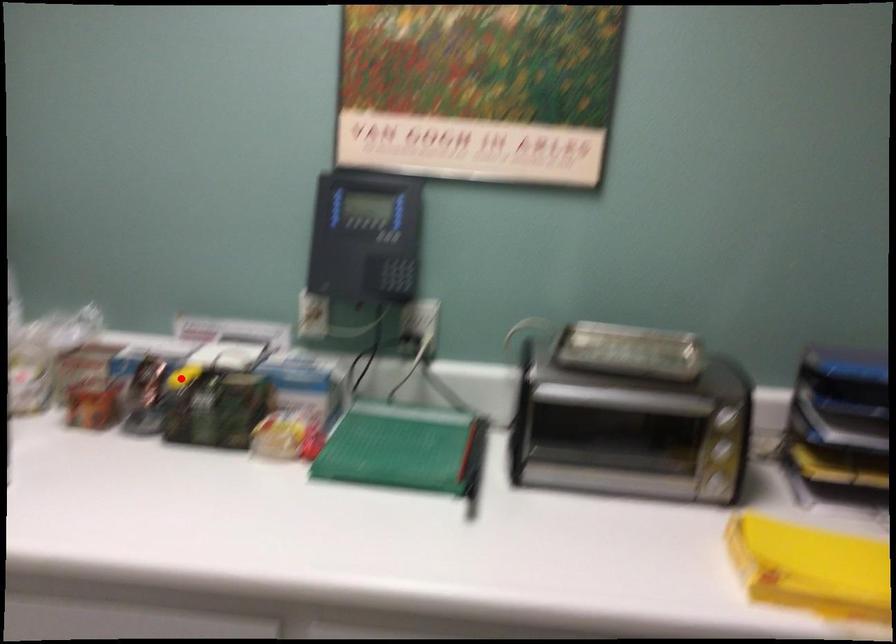
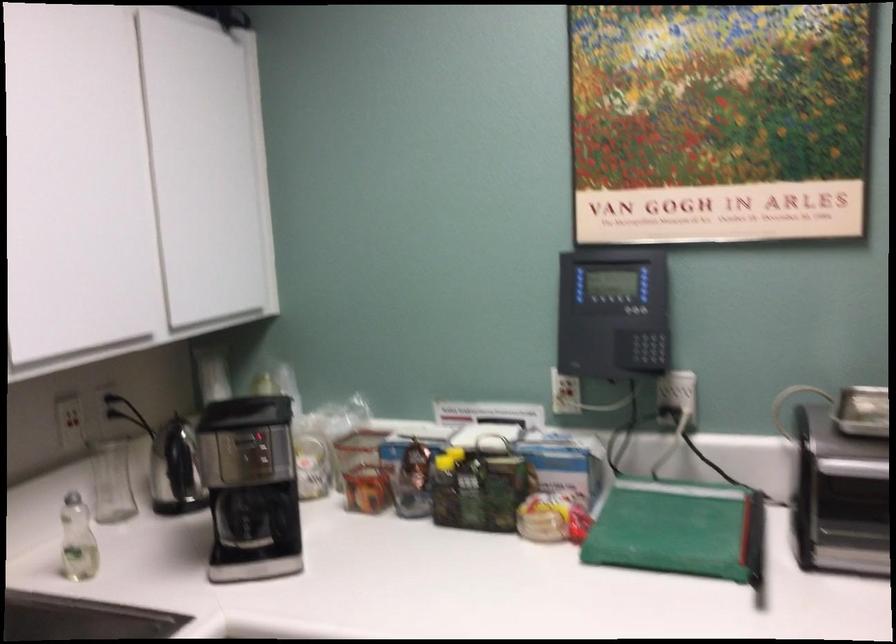
The point at the highlighted location is marked in the first image. Where is the corresponding point in the second image?

(444, 462)